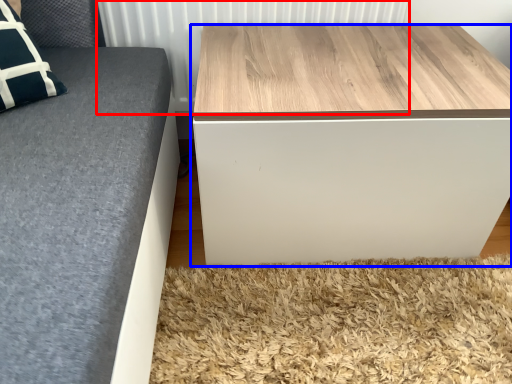
Question: Which object appears closest to the camera in this image, radiator (highlighted by a red box) or table (highlighted by a blue box)?

Choices:
 (A) radiator
 (B) table

Answer: (B)